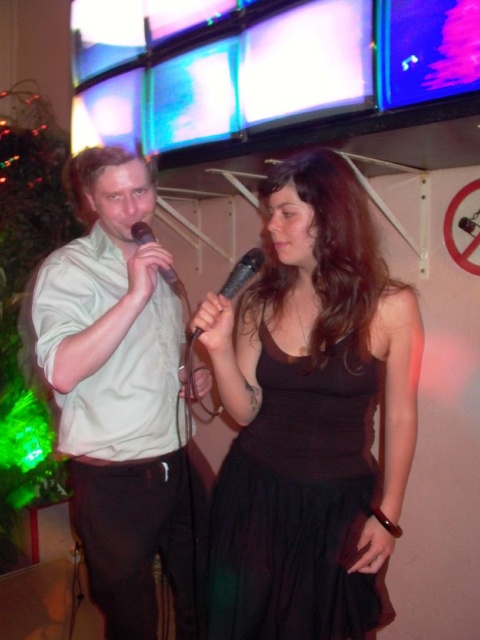
Between matte white shirt at left and black matte microphone at center, which one has more height?

With more height is matte white shirt at left.

I want to click on matte white shirt at left, so click(x=120, y=397).

Who is shorter, black matte microphone at center or black matte microphone at left?

Standing shorter between the two is black matte microphone at left.

Between black matte microphone at center and black matte microphone at left, which one appears on the right side from the viewer's perspective?

From the viewer's perspective, black matte microphone at center appears more on the right side.

Between point (243, 259) and point (158, 268), which one is positioned in front?

Point (243, 259)

Where is `black matte microphone at center`? This screenshot has height=640, width=480. black matte microphone at center is located at coordinates (241, 273).

Does black satin dress at center have a smaller size compared to black matte microphone at center?

Actually, black satin dress at center might be larger than black matte microphone at center.

Between black satin dress at center and black matte microphone at center, which one has less height?

black matte microphone at center

Is point (380, 385) more distant than point (242, 257)?

Yes, point (380, 385) is farther from viewer.

I want to click on black satin dress at center, so click(299, 502).